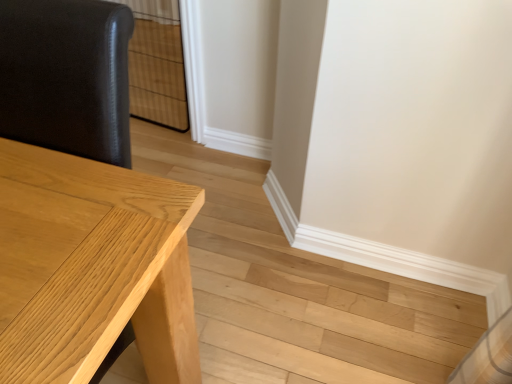
What is the approximate height of light wood table at left?

The height of light wood table at left is 1.04 meters.

The image size is (512, 384). Describe the element at coordinates (92, 267) in the screenshot. I see `light wood table at left` at that location.

Find the location of a particular element. The image size is (512, 384). light wood table at left is located at coordinates (92, 267).

Locate an element on the screen. This screenshot has height=384, width=512. light wood table at left is located at coordinates (92, 267).